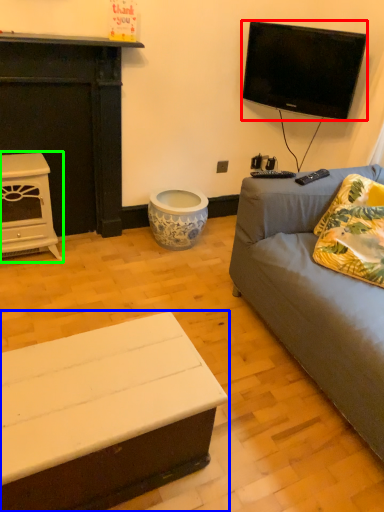
Question: Which object is the closest to the television (highlighted by a red box)? Choose among these: coffee table (highlighted by a blue box) or fireplace (highlighted by a green box).

Choices:
 (A) coffee table
 (B) fireplace

Answer: (B)